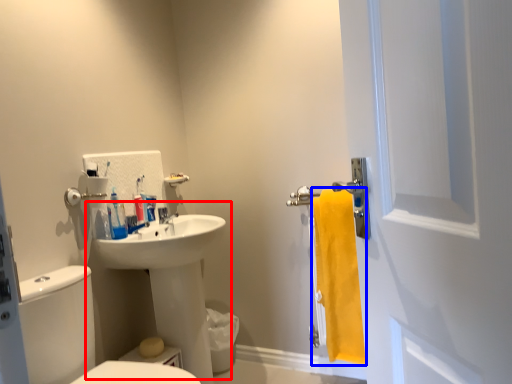
Question: Which object is further to the camera taking this photo, sink (highlighted by a red box) or bath towel (highlighted by a blue box)?

Choices:
 (A) sink
 (B) bath towel

Answer: (B)